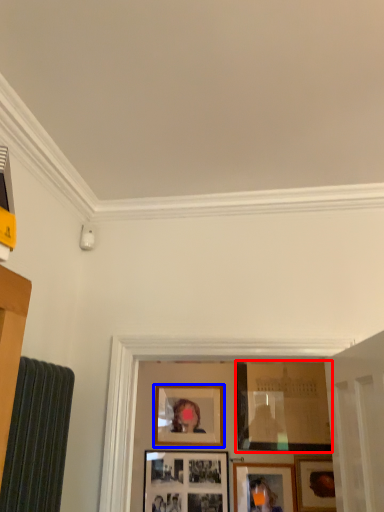
Question: Which object appears closest to the camera in this image, picture frame (highlighted by a red box) or picture frame (highlighted by a blue box)?

Choices:
 (A) picture frame
 (B) picture frame

Answer: (A)